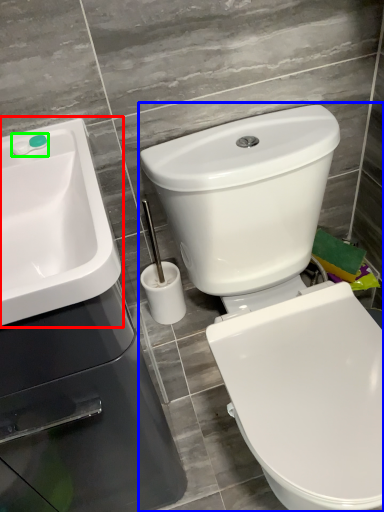
Question: Estimate the real-world distances between objects in this image. Which object is closer to sink (highlighted by a red box), toilet (highlighted by a blue box) or plumbing fixture (highlighted by a green box)?

Choices:
 (A) toilet
 (B) plumbing fixture

Answer: (B)